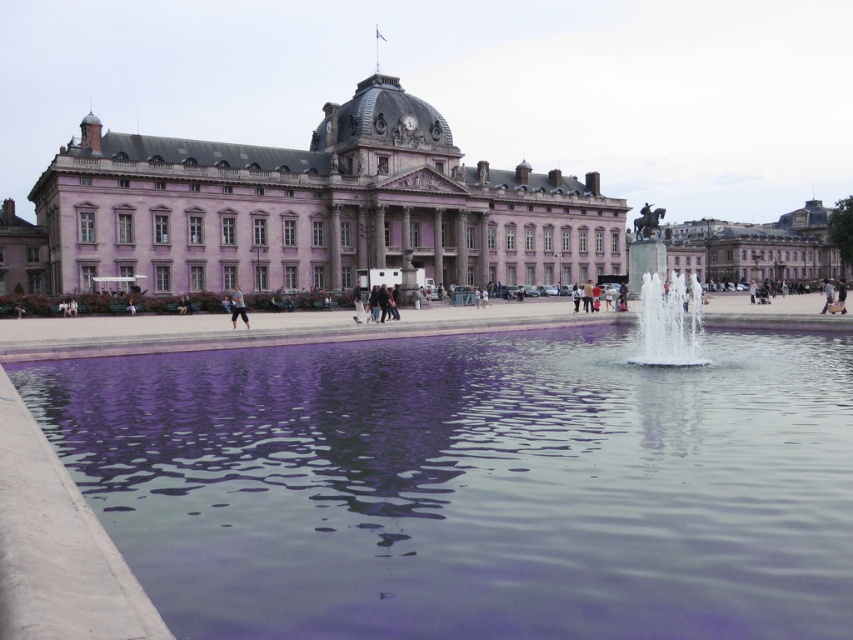
Is transparent glass water at center to the right of dark gray fabric pants at center from the viewer's perspective?

Correct, you'll find transparent glass water at center to the right of dark gray fabric pants at center.

Who is more forward, (544, 346) or (360, 292)?

Point (544, 346)

This screenshot has height=640, width=853. In order to click on transparent glass water at center in this screenshot , I will do `click(471, 484)`.

Identify the location of transparent glass water at center. The height and width of the screenshot is (640, 853). (471, 484).

What do you see at coordinates (471, 484) in the screenshot? Image resolution: width=853 pixels, height=640 pixels. I see `transparent glass water at center` at bounding box center [471, 484].

Can you confirm if transparent glass water at center is smaller than clear glass fountain at center?

Actually, transparent glass water at center might be larger than clear glass fountain at center.

This screenshot has height=640, width=853. What do you see at coordinates (471, 484) in the screenshot?
I see `transparent glass water at center` at bounding box center [471, 484].

The width and height of the screenshot is (853, 640). What are the coordinates of `transparent glass water at center` in the screenshot? It's located at (471, 484).

Between transparent glass water at center and light brown leather jacket at center, which one appears on the right side from the viewer's perspective?

transparent glass water at center

Between point (730, 388) and point (241, 305), which one is positioned behind?

Point (241, 305)

I want to click on transparent glass water at center, so click(471, 484).